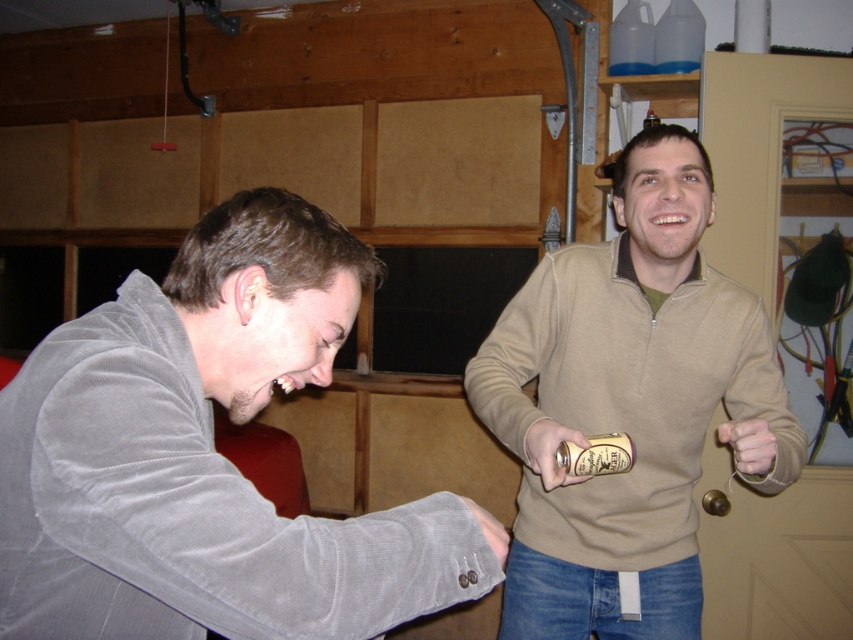
In the scene shown: You are standing in the garage and want to place a new shelf between the two points labeled point (666, 358) and point (763, 420). Which point should the shelf be closer to in order to be placed behind the person in the gray corduroy jacket?

The shelf should be placed closer to point (763, 420) because point (666, 358) is behind point (763, 420), so placing it near the latter keeps it in front of the person in the gray corduroy jacket.

You are a tailor measuring two items in the image. The velvet gray jacket at left and the gray corduroy hand at lower left. Which item requires a larger measurement tape? Please explain your reasoning based on their sizes.

The velvet gray jacket at left requires a larger measurement tape because it is bigger than the gray corduroy hand at lower left.